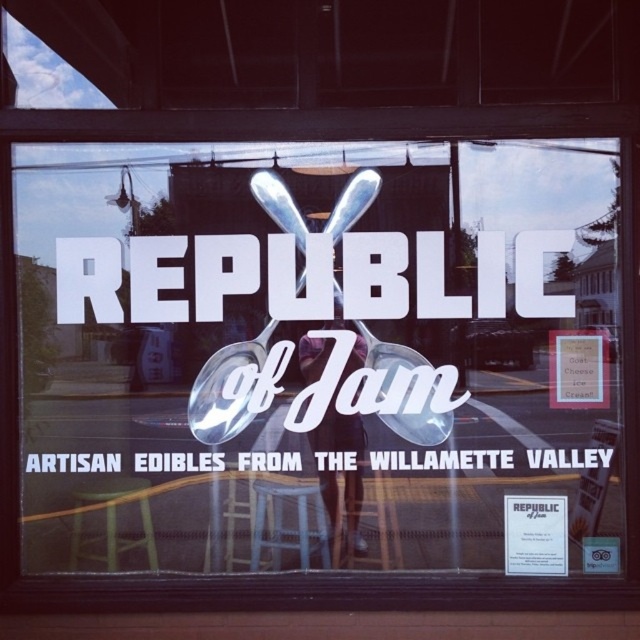
Does yellow plastic stool at lower left have a lesser height compared to matte brown sign at center right?

Incorrect, yellow plastic stool at lower left's height does not fall short of matte brown sign at center right's.

Does point (116, 496) come farther from viewer compared to point (589, 401)?

Yes, it is.

This screenshot has width=640, height=640. I want to click on yellow plastic stool at lower left, so click(x=112, y=522).

Can you confirm if matte glass sign at center is bigger than yellow plastic stool at lower left?

Yes.

Is matte glass sign at center above yellow plastic stool at lower left?

Yes, matte glass sign at center is above yellow plastic stool at lower left.

Which is behind, point (596, 177) or point (96, 556)?

The point (96, 556) is behind.

Identify the location of matte glass sign at center. [307, 355].

Between point (509, 412) and point (324, 541), which one is positioned in front?

Positioned in front is point (509, 412).

I want to click on matte glass sign at center, so click(x=307, y=355).

Locate an element on the screen. matte glass sign at center is located at coordinates (307, 355).